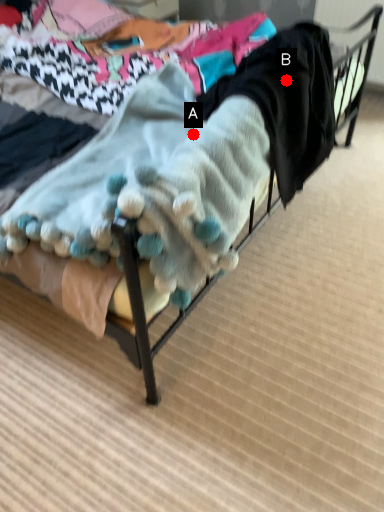
Question: Two points are circled on the image, labeled by A and B beside each circle. Which point appears closest to the camera in this image?

Choices:
 (A) A is closer
 (B) B is closer

Answer: (A)